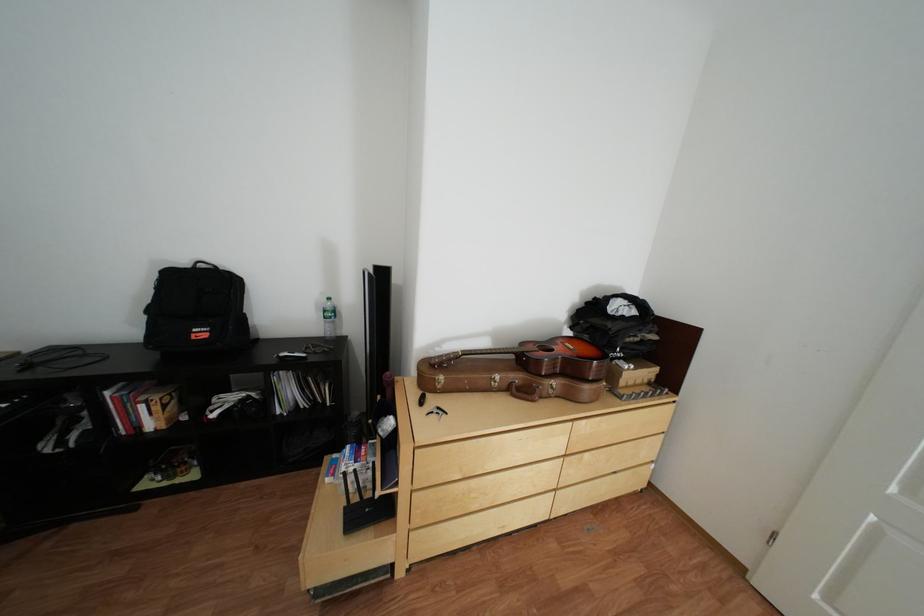
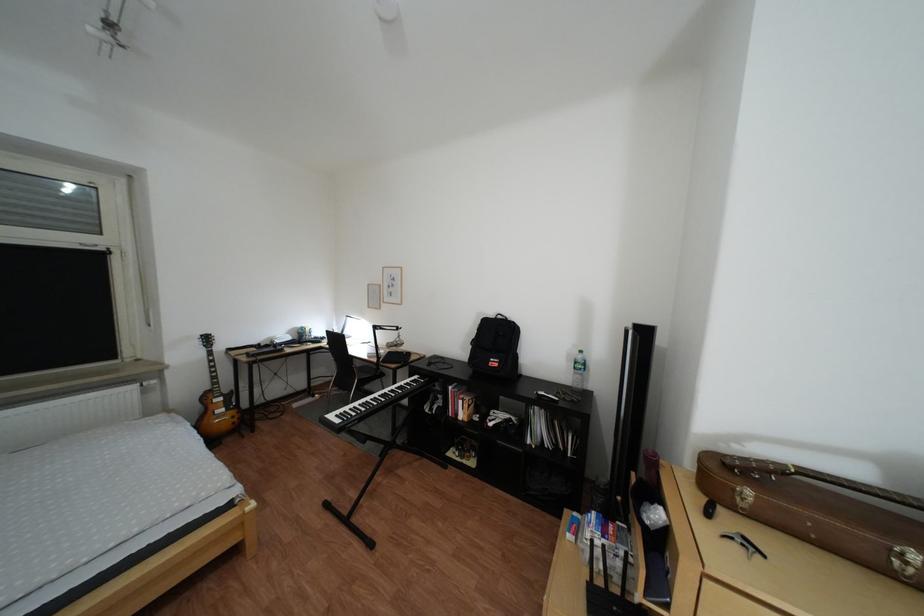
Locate, in the second image, the point that corresponds to point (451, 381) in the first image.

(749, 491)